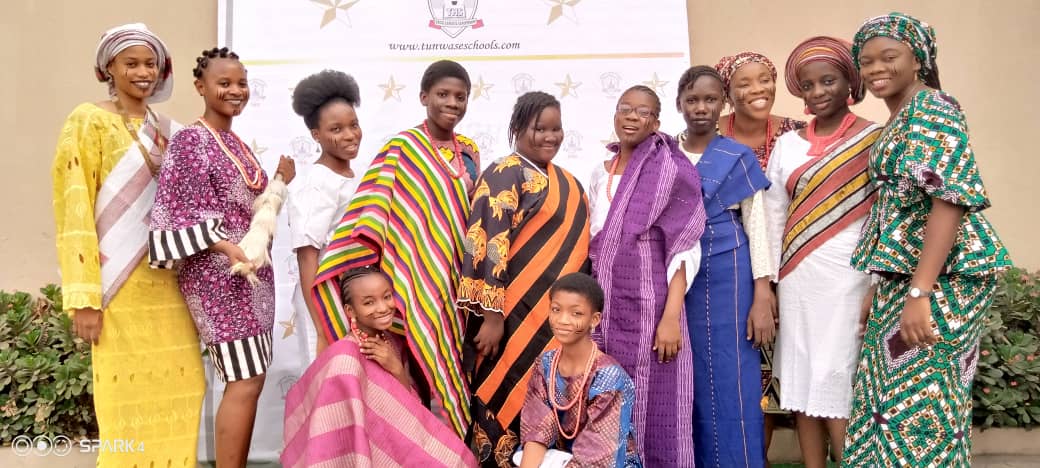
Locate an element on the screen. tan walls is located at coordinates (43, 55), (973, 40).